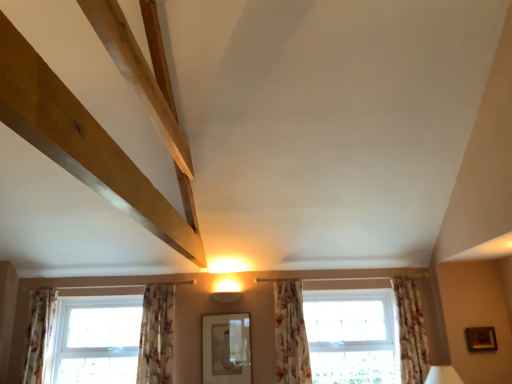
Question: Relative to clear glass window at lower left, which ranks as the 2th window in right-to-left order, is floral fabric curtain at lower left, placed as the third curtain when sorted from right to left, in front or behind?

Choices:
 (A) behind
 (B) front

Answer: (B)

Question: Does point (140, 377) appear closer or farther from the camera than point (170, 360)?

Choices:
 (A) farther
 (B) closer

Answer: (A)

Question: Considering the real-world distances, which object is closest to the floral fabric curtain at center, positioned as the 2th curtain in right-to-left order?

Choices:
 (A) matte white lampshade at lower right
 (B) matte glass mirror at center
 (C) gold metallic picture frame at lower right
 (D) floral fabric curtain at lower left, the 1th curtain positioned from the left
 (E) floral fabric curtain at right, the fourth curtain positioned from the left

Answer: (B)

Question: Estimate the real-world distances between objects in this image. Which object is closer to the matte glass mirror at center?

Choices:
 (A) clear glass window at lower left, the first window from the left
 (B) floral fabric curtain at lower left, which is the 2th curtain in left-to-right order
 (C) gold metallic picture frame at lower right
 (D) matte white lampshade at lower right
 (E) floral fabric curtain at center, positioned as the 2th curtain in right-to-left order

Answer: (E)